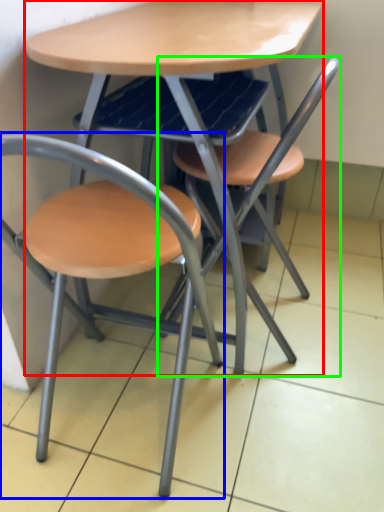
Question: Based on their relative distances, which object is farther from table (highlighted by a red box)? Choose from chair (highlighted by a blue box) and chair (highlighted by a green box).

Choices:
 (A) chair
 (B) chair

Answer: (A)